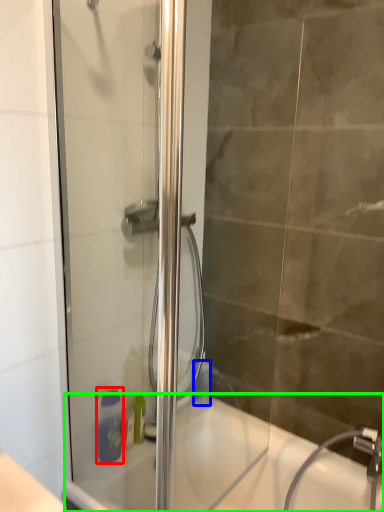
Question: Which object is the farthest from soap dispenser (highlighted by a red box)? Choose among these: toiletry (highlighted by a blue box) or bath (highlighted by a green box).

Choices:
 (A) toiletry
 (B) bath

Answer: (A)